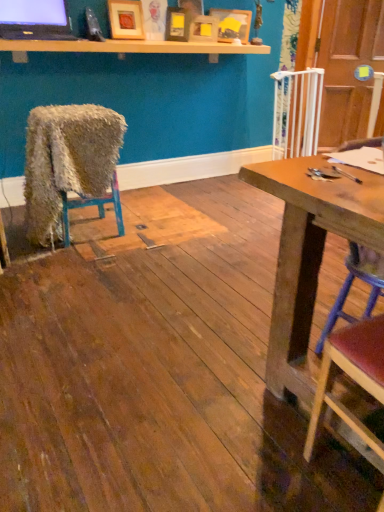
Question: Is light wood shelf at upper center taller than wooden picture frame at upper center, which is counted as the 4th picture frame, starting from the left?

Choices:
 (A) yes
 (B) no

Answer: (B)

Question: Considering the relative sizes of light wood shelf at upper center and wooden picture frame at upper center, arranged as the 1th picture frame when viewed from the right, in the image provided, is light wood shelf at upper center shorter than wooden picture frame at upper center, arranged as the 1th picture frame when viewed from the right,?

Choices:
 (A) no
 (B) yes

Answer: (B)

Question: Does light wood shelf at upper center contain wooden picture frame at upper center, which is counted as the 4th picture frame, starting from the left?

Choices:
 (A) yes
 (B) no

Answer: (B)

Question: Is wooden picture frame at upper center, arranged as the 1th picture frame when viewed from the right, at the back of light wood shelf at upper center?

Choices:
 (A) no
 (B) yes

Answer: (A)

Question: Considering the relative sizes of light wood shelf at upper center and wooden picture frame at upper center, arranged as the 1th picture frame when viewed from the right, in the image provided, is light wood shelf at upper center bigger than wooden picture frame at upper center, arranged as the 1th picture frame when viewed from the right,?

Choices:
 (A) no
 (B) yes

Answer: (B)

Question: From a real-world perspective, is wooden picture frame at upper center, which is the 4th picture frame from right to left, positioned above or below matte wooden picture frame at upper center, the third picture frame when ordered from right to left?

Choices:
 (A) below
 (B) above

Answer: (B)

Question: Is wooden picture frame at upper center, which is the 4th picture frame from right to left, inside or outside of matte wooden picture frame at upper center, positioned as the 2th picture frame in left-to-right order?

Choices:
 (A) inside
 (B) outside

Answer: (B)

Question: In the image, is wooden picture frame at upper center, the 1th picture frame when ordered from left to right, on the left side or the right side of matte wooden picture frame at upper center, positioned as the 2th picture frame in left-to-right order?

Choices:
 (A) left
 (B) right

Answer: (A)

Question: Considering the positions of wooden picture frame at upper center, which is the 4th picture frame from right to left, and matte wooden picture frame at upper center, positioned as the 2th picture frame in left-to-right order, in the image, is wooden picture frame at upper center, which is the 4th picture frame from right to left, bigger or smaller than matte wooden picture frame at upper center, positioned as the 2th picture frame in left-to-right order,?

Choices:
 (A) small
 (B) big

Answer: (B)

Question: Looking at their shapes, would you say matte wooden picture frame at upper center, positioned as the 2th picture frame in left-to-right order, is wider or thinner than wooden seat at right, the 1th chair when ordered from right to left?

Choices:
 (A) wide
 (B) thin

Answer: (B)

Question: From a real-world perspective, is matte wooden picture frame at upper center, the third picture frame when ordered from right to left, above or below wooden seat at right, positioned as the 2th chair in front-to-back order?

Choices:
 (A) below
 (B) above

Answer: (B)

Question: Based on their sizes in the image, would you say matte wooden picture frame at upper center, the third picture frame when ordered from right to left, is bigger or smaller than wooden seat at right, the second chair from the back?

Choices:
 (A) small
 (B) big

Answer: (A)

Question: From the image's perspective, relative to wooden seat at right, positioned as the 2th chair in front-to-back order, is matte wooden picture frame at upper center, positioned as the 2th picture frame in left-to-right order, above or below?

Choices:
 (A) below
 (B) above

Answer: (B)

Question: Visually, is light wood shelf at upper center positioned to the left or to the right of matte wooden picture frame at upper center, the third picture frame when ordered from right to left?

Choices:
 (A) right
 (B) left

Answer: (B)

Question: In the image, is light wood shelf at upper center positioned in front of or behind matte wooden picture frame at upper center, the third picture frame when ordered from right to left?

Choices:
 (A) front
 (B) behind

Answer: (A)